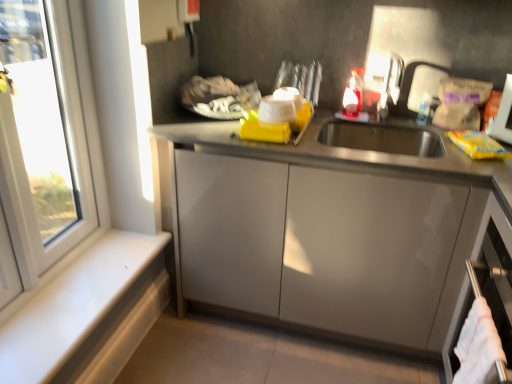
Question: From a real-world perspective, relative to satin silver dishwasher at lower right, is white plastic window at left vertically above or below?

Choices:
 (A) below
 (B) above

Answer: (B)

Question: In terms of size, does white plastic window at left appear bigger or smaller than satin silver dishwasher at lower right?

Choices:
 (A) small
 (B) big

Answer: (A)

Question: Based on their relative distances, which object is nearer to the white plastic window at left?

Choices:
 (A) white matte window sill at lower left
 (B) satin silver dishwasher at lower right
 (C) satin nickel faucet at upper right
 (D) white cotton towel at lower right
 (E) yellow matte packet at right

Answer: (A)

Question: Which object is positioned closest to the satin silver dishwasher at lower right?

Choices:
 (A) white matte window sill at lower left
 (B) yellow matte packet at right
 (C) white plastic window at left
 (D) satin nickel faucet at upper right
 (E) white cotton towel at lower right

Answer: (E)